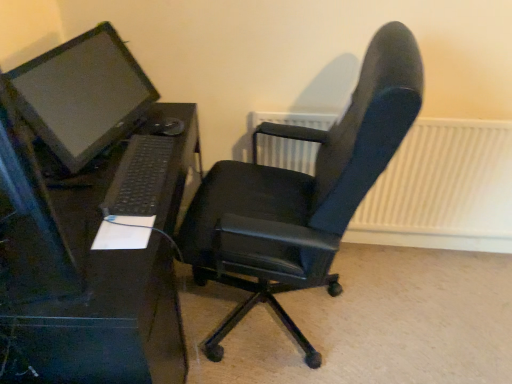
Question: Is black plastic desk at left placed right next to black leather office chair at center?

Choices:
 (A) yes
 (B) no

Answer: (B)

Question: From the image's perspective, is black plastic desk at left beneath black leather office chair at center?

Choices:
 (A) no
 (B) yes

Answer: (B)

Question: Is black plastic desk at left oriented towards black leather office chair at center?

Choices:
 (A) no
 (B) yes

Answer: (B)

Question: Is the depth of black plastic desk at left greater than that of black leather office chair at center?

Choices:
 (A) yes
 (B) no

Answer: (A)

Question: From a real-world perspective, is black plastic desk at left positioned under black leather office chair at center based on gravity?

Choices:
 (A) yes
 (B) no

Answer: (A)

Question: Considering the relative sizes of black plastic desk at left and black leather office chair at center in the image provided, is black plastic desk at left shorter than black leather office chair at center?

Choices:
 (A) no
 (B) yes

Answer: (B)

Question: Does black plastic keyboard at lower left have a greater height compared to black plastic desk at left?

Choices:
 (A) yes
 (B) no

Answer: (B)

Question: Is black plastic desk at left surrounded by black plastic keyboard at lower left?

Choices:
 (A) yes
 (B) no

Answer: (B)

Question: Is black plastic keyboard at lower left at the left side of black plastic desk at left?

Choices:
 (A) no
 (B) yes

Answer: (A)

Question: Is black plastic keyboard at lower left bigger than black plastic desk at left?

Choices:
 (A) no
 (B) yes

Answer: (A)

Question: Is black plastic keyboard at lower left aimed at black plastic desk at left?

Choices:
 (A) yes
 (B) no

Answer: (B)

Question: Does black plastic keyboard at lower left appear on the right side of black plastic desk at left?

Choices:
 (A) yes
 (B) no

Answer: (A)

Question: Considering the relative sizes of white textured radiator at upper right and black plastic keyboard at lower left in the image provided, is white textured radiator at upper right smaller than black plastic keyboard at lower left?

Choices:
 (A) yes
 (B) no

Answer: (B)